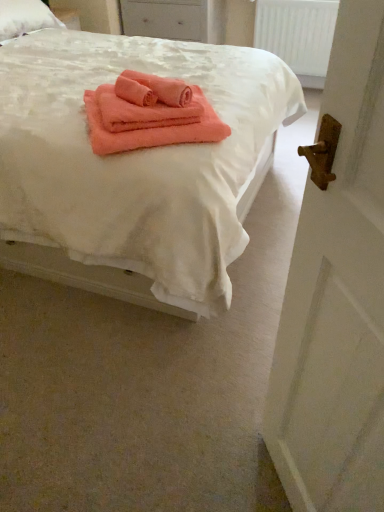
Question: Is white plastic radiator at upper center wider or thinner than coral soft towel at center?

Choices:
 (A) wide
 (B) thin

Answer: (B)

Question: Is white plastic radiator at upper center in front of or behind coral soft towel at center in the image?

Choices:
 (A) front
 (B) behind

Answer: (B)

Question: Which is farther from the coral soft towel at center?

Choices:
 (A) white plastic radiator at upper center
 (B) white matte drawer at upper center
 (C) white wooden door at right
 (D) coral soft towel at center
 (E) coral soft towel at center

Answer: (B)

Question: Which object is the closest to the white wooden door at right?

Choices:
 (A) coral soft towel at center
 (B) coral soft towel at center
 (C) coral soft towel at center
 (D) white matte drawer at upper center
 (E) white plastic radiator at upper center

Answer: (A)